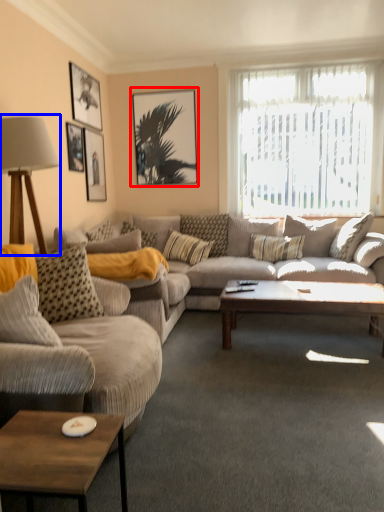
Question: Among these objects, which one is farthest to the camera, picture frame (highlighted by a red box) or table lamp (highlighted by a blue box)?

Choices:
 (A) picture frame
 (B) table lamp

Answer: (A)